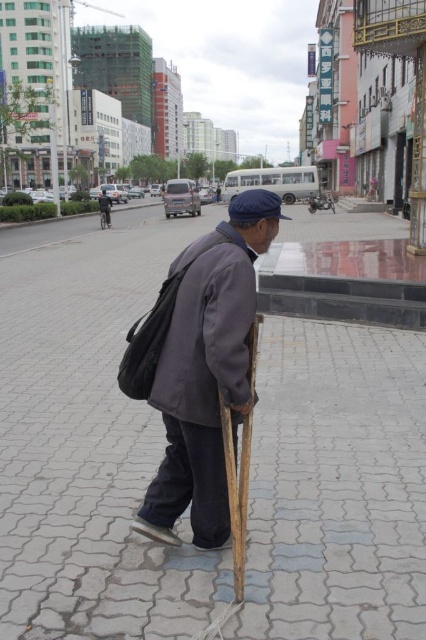
Question: Which of the following is the farthest from the observer?

Choices:
 (A) (178, 493)
 (B) (94, 620)

Answer: (A)

Question: From the image, what is the correct spatial relationship of gray cobblestone pavement at center in relation to dark gray fabric jacket at center?

Choices:
 (A) left
 (B) right

Answer: (B)

Question: Is gray cobblestone pavement at center thinner than dark gray fabric jacket at center?

Choices:
 (A) no
 (B) yes

Answer: (A)

Question: Observing the image, what is the correct spatial positioning of gray cobblestone pavement at center in reference to dark gray woolen jacket at center?

Choices:
 (A) below
 (B) above

Answer: (B)

Question: Estimate the real-world distances between objects in this image. Which object is closer to the dark gray woolen jacket at center?

Choices:
 (A) gray cobblestone pavement at center
 (B) dark gray fabric jacket at center

Answer: (B)

Question: Considering the real-world distances, which object is farthest from the gray cobblestone pavement at center?

Choices:
 (A) dark gray fabric jacket at center
 (B) dark gray woolen jacket at center

Answer: (B)